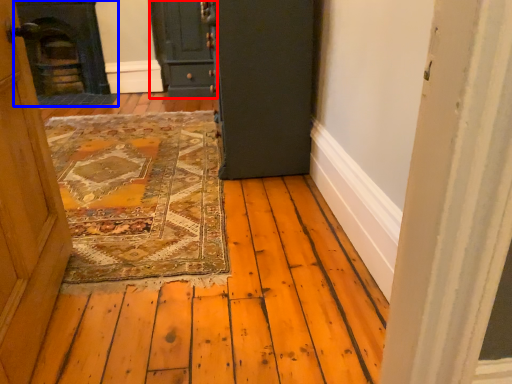
Question: Which object appears farthest to the camera in this image, door (highlighted by a red box) or fireplace (highlighted by a blue box)?

Choices:
 (A) door
 (B) fireplace

Answer: (B)